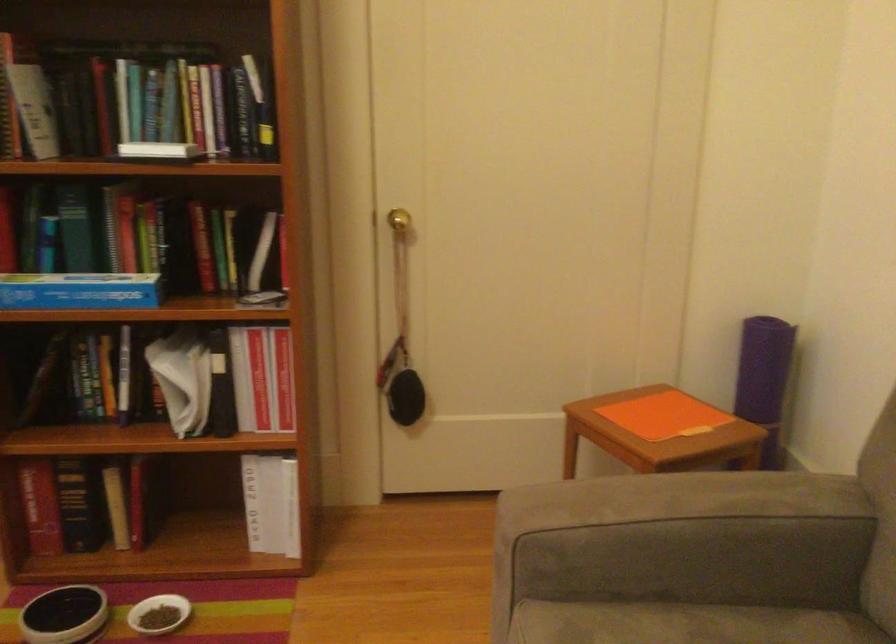
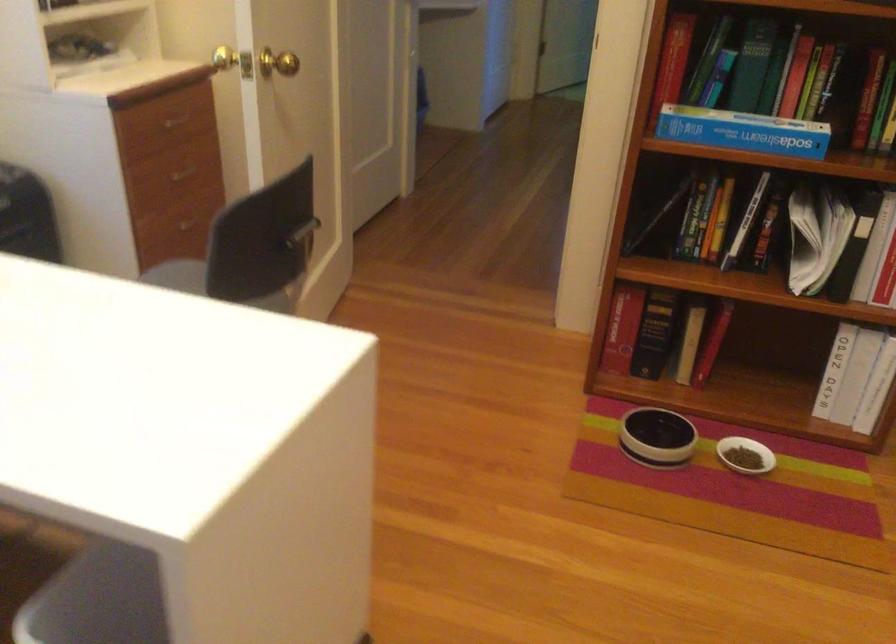
Find the pixel in the second image that matches [74,506] in the first image.

(655, 334)